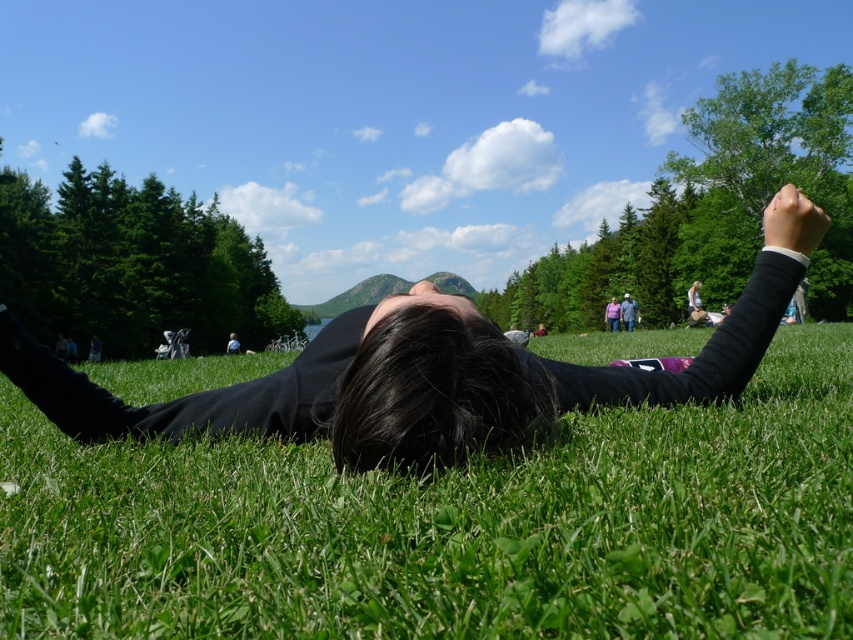
Is black matte person at center below gray fabric jacket at center?

Yes, black matte person at center is below gray fabric jacket at center.

Locate an element on the screen. This screenshot has height=640, width=853. black matte person at center is located at coordinates (428, 372).

The width and height of the screenshot is (853, 640). What do you see at coordinates (428, 372) in the screenshot? I see `black matte person at center` at bounding box center [428, 372].

Where is `black matte person at center`? black matte person at center is located at coordinates (428, 372).

What are the coordinates of `green grass at center` in the screenshot? It's located at (451, 525).

Can you confirm if green grass at center is taller than pink fabric at center?

Incorrect, green grass at center's height is not larger of pink fabric at center's.

The image size is (853, 640). What do you see at coordinates (451, 525) in the screenshot?
I see `green grass at center` at bounding box center [451, 525].

Find the location of `green grass at center`. green grass at center is located at coordinates (451, 525).

Does green grass at center appear on the right side of gray fabric jacket at center?

In fact, green grass at center is to the left of gray fabric jacket at center.

Between green grass at center and gray fabric jacket at center, which one has less height?

Standing shorter between the two is green grass at center.

This screenshot has height=640, width=853. Describe the element at coordinates (451, 525) in the screenshot. I see `green grass at center` at that location.

You are a GUI agent. You are given a task and a screenshot of the screen. Output one action in this format:
    pyautogui.click(x=<x>, y=<y>)
    Task: Click on the green grass at center
    The image size is (853, 640).
    Given the screenshot: What is the action you would take?
    pyautogui.click(x=451, y=525)